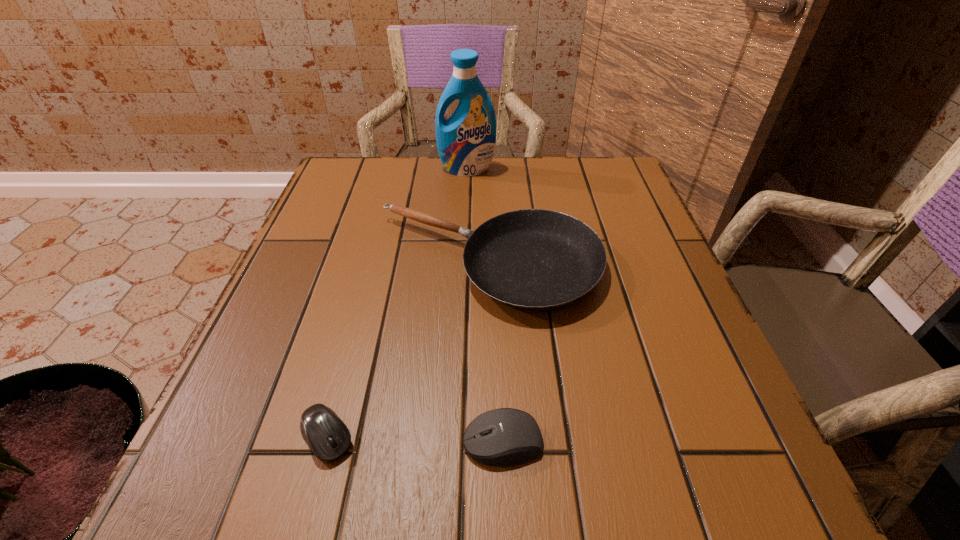
Find the location of a particular element. The image size is (960, 540). object located at the far edge is located at coordinates (466, 141).

Locate an element on the screen. Image resolution: width=960 pixels, height=540 pixels. object situated at the left edge is located at coordinates (326, 434).

Where is `object situated at the right edge`? This screenshot has height=540, width=960. object situated at the right edge is located at coordinates (532, 259).

Locate an element on the screen. The height and width of the screenshot is (540, 960). object that is at the near left corner is located at coordinates (326, 434).

Locate an element on the screen. This screenshot has height=540, width=960. vacant area at the far edge is located at coordinates (543, 202).

This screenshot has height=540, width=960. Find the location of `free space at the left edge of the desktop`. free space at the left edge of the desktop is located at coordinates (315, 249).

Identify the location of free point at the right edge. This screenshot has width=960, height=540. (679, 355).

This screenshot has height=540, width=960. Identify the location of free space at the far left corner. (335, 183).

Find the location of a particular element. Image resolution: width=960 pixels, height=540 pixels. free location at the far right corner is located at coordinates (582, 184).

This screenshot has width=960, height=540. Identify the location of empty space between the left computer equipment and the right computer equipment. (415, 440).